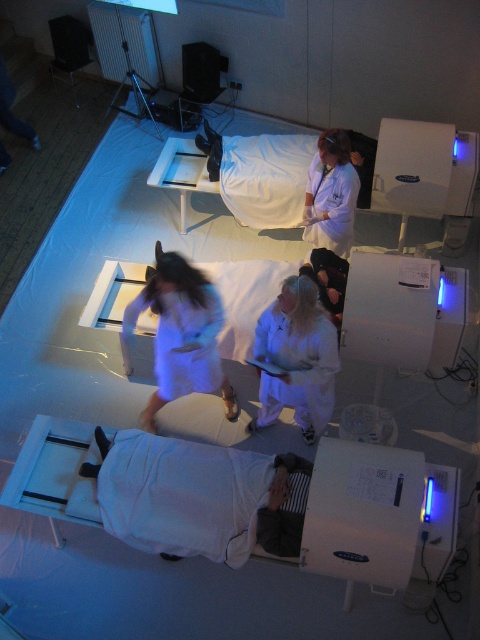
Is point (120, 433) farther from camera compared to point (223, 179)?

No, (120, 433) is closer to viewer.

Which of these two, white matte/soft robe at lower center or white fabric bed at center, stands taller?

white fabric bed at center

You are a GUI agent. You are given a task and a screenshot of the screen. Output one action in this format:
    pyautogui.click(x=<x>, y=<y>)
    Task: Click on the white matte/soft robe at lower center
    
    Given the screenshot: What is the action you would take?
    pyautogui.click(x=182, y=496)

Is point (153, 534) farther from camera compared to point (314, 394)?

That is False.

Does white matte/soft robe at lower center appear under white matte/soft robe at center?

Yes.

What do you see at coordinates (182, 496) in the screenshot? I see `white matte/soft robe at lower center` at bounding box center [182, 496].

The image size is (480, 640). Identify the location of white matte/soft robe at lower center. (182, 496).

In the scene shown: Is white matte/soft robe at lower center to the right of white matte lab coat at upper center from the viewer's perspective?

Incorrect, white matte/soft robe at lower center is not on the right side of white matte lab coat at upper center.

Measure the distance between point (163, 516) and camera.

They are 11.74 feet apart.

This screenshot has height=640, width=480. I want to click on white matte/soft robe at lower center, so click(182, 496).